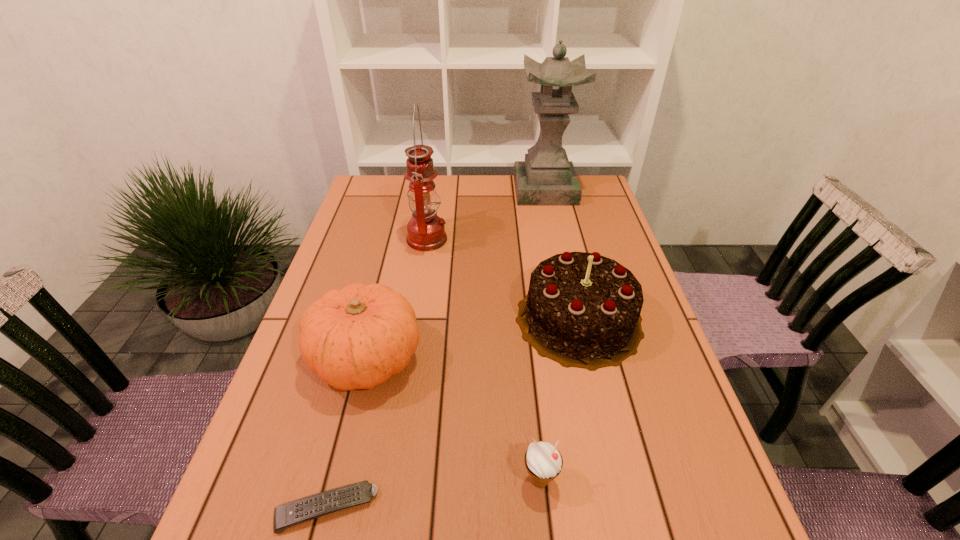
The image size is (960, 540). I want to click on free space that satisfies the following two spatial constraints: 1. on the front side of the second shortest object; 2. on the left side of the pumpkin, so 337,480.

You are a GUI agent. You are given a task and a screenshot of the screen. Output one action in this format:
    pyautogui.click(x=<x>, y=<y>)
    Task: Click on the free space in the image that satisfies the following two spatial constraints: 1. at the front opening of the third tallest object; 2. on the right side of the sculpture
    Image resolution: width=960 pixels, height=540 pixels.
    Given the screenshot: What is the action you would take?
    click(573, 319)

Locate an element on the screen. This screenshot has width=960, height=540. vacant region that satisfies the following two spatial constraints: 1. at the front opening of the third tallest object; 2. on the right side of the tallest object is located at coordinates (573, 319).